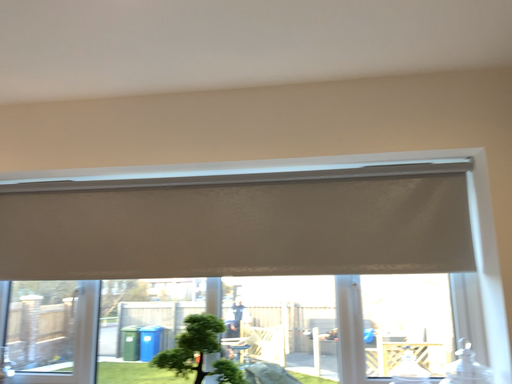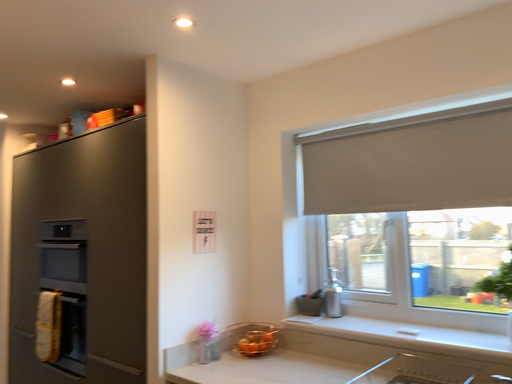
Question: Which way did the camera rotate in the video?

Choices:
 (A) rotated left
 (B) rotated right

Answer: (A)